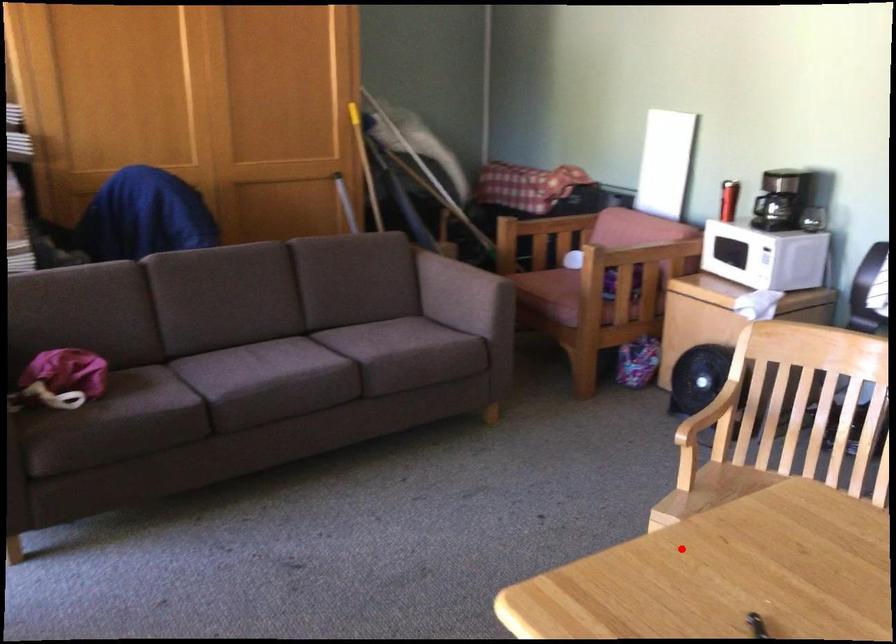
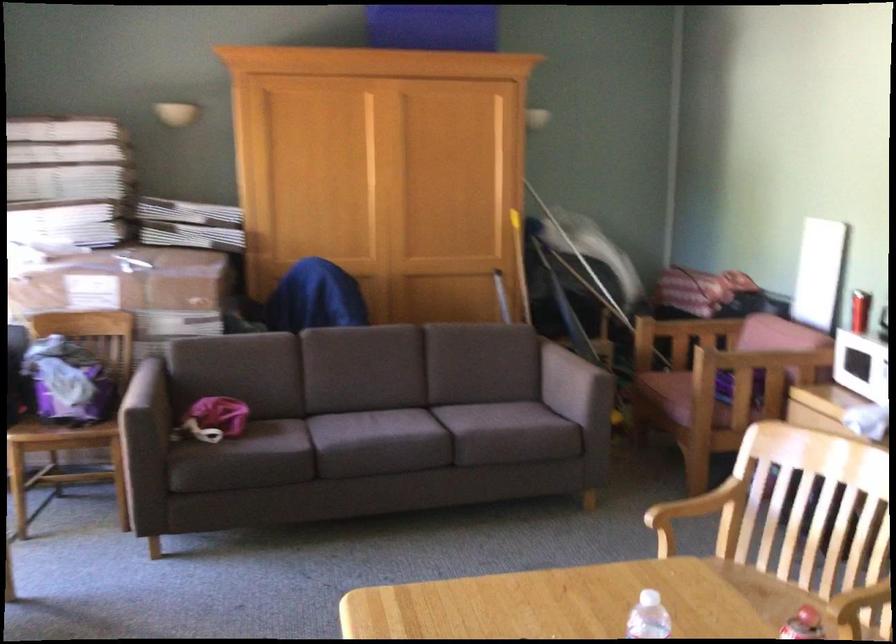
Question: A red point is marked in image1. In image2, is the corresponding 3D point closer to the camera or farther? Reply with the corresponding letter.

Choices:
 (A) The corresponding 3D point is closer.
 (B) The corresponding 3D point is farther.

Answer: (B)